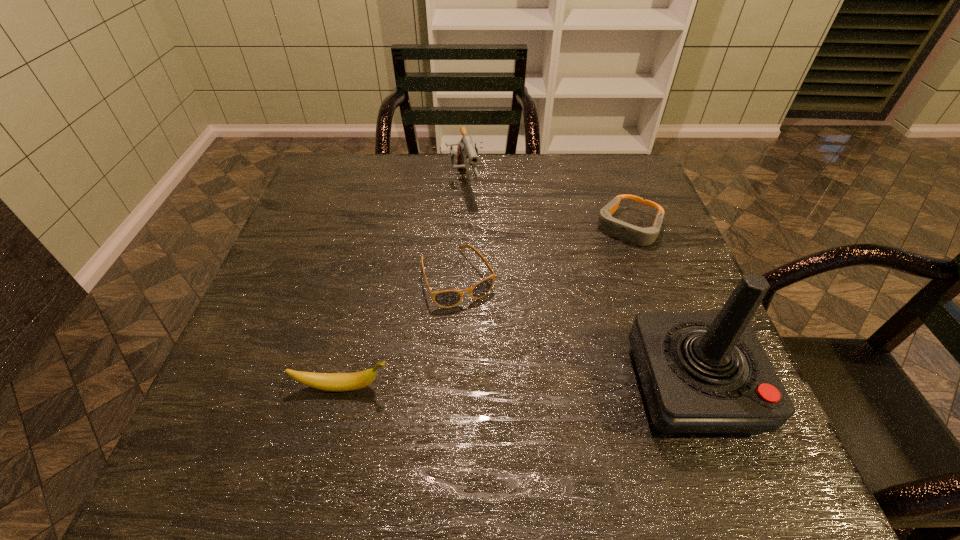
The height and width of the screenshot is (540, 960). I want to click on the third shortest object, so click(337, 382).

Locate an element on the screen. banana is located at coordinates (337, 382).

Locate an element on the screen. The height and width of the screenshot is (540, 960). the tallest object is located at coordinates (701, 373).

The height and width of the screenshot is (540, 960). Find the location of `sunglasses`. sunglasses is located at coordinates (446, 298).

Find the location of a particular element. goggles is located at coordinates (632, 234).

In order to click on the fourth shortest object in this screenshot , I will do `click(465, 149)`.

Where is `vacant position located 0.310m at the stem of the banana`? Image resolution: width=960 pixels, height=540 pixels. vacant position located 0.310m at the stem of the banana is located at coordinates (563, 387).

Where is `vacant area situated on the front-facing side of the sunglasses`? vacant area situated on the front-facing side of the sunglasses is located at coordinates (495, 354).

Locate an element on the screen. The image size is (960, 540). vacant space situated on the front-facing side of the sunglasses is located at coordinates pos(519,402).

Where is `free region located on the front-facing side of the sunglasses`? The image size is (960, 540). free region located on the front-facing side of the sunglasses is located at coordinates (492, 346).